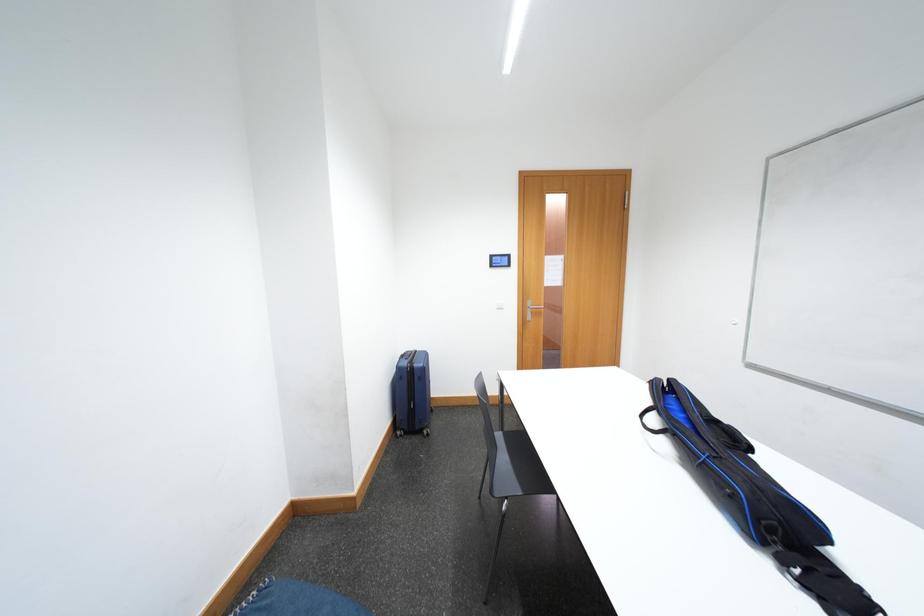
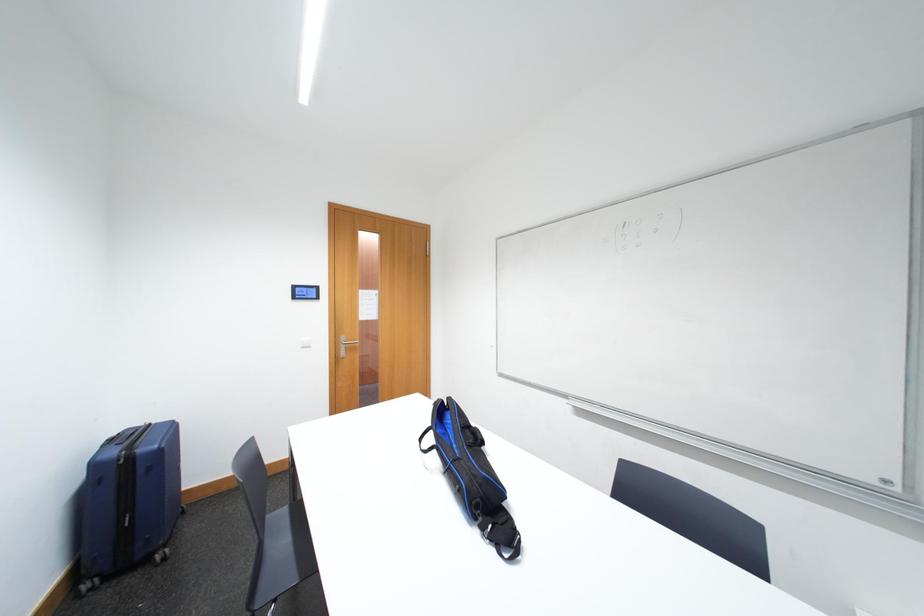
Question: Based on the continuous images, in which direction is the camera rotating? Reply with the corresponding letter.

Choices:
 (A) Left
 (B) Right
 (C) Up
 (D) Down

Answer: (B)